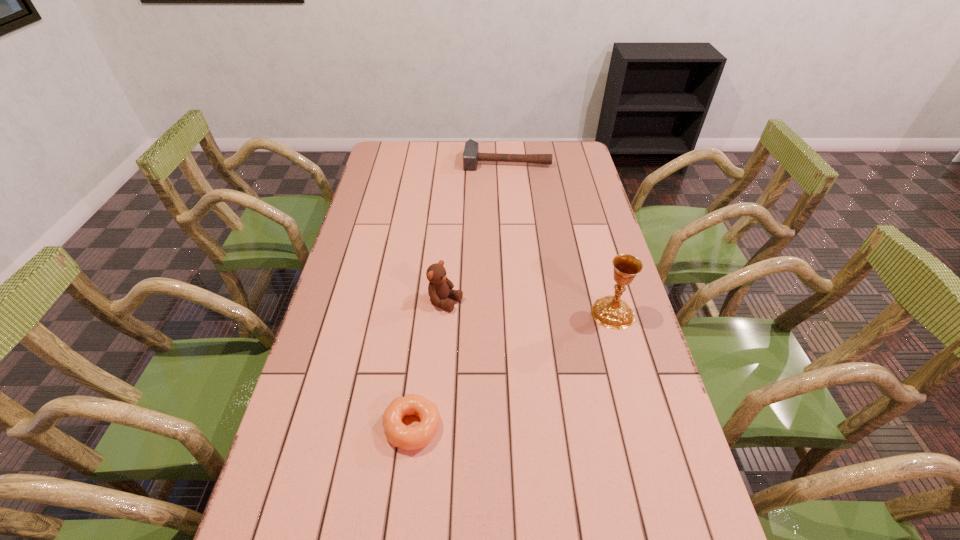
Find the location of a particular element. This screenshot has height=540, width=960. the nearest object is located at coordinates (404, 437).

Where is `the shortest object`? the shortest object is located at coordinates (404, 437).

Where is `chalice`? The width and height of the screenshot is (960, 540). chalice is located at coordinates (611, 312).

Locate an element on the screen. This screenshot has height=540, width=960. the tallest object is located at coordinates (611, 312).

Find the location of a particular element. The height and width of the screenshot is (540, 960). teddy bear is located at coordinates (440, 287).

This screenshot has width=960, height=540. In order to click on hammer in this screenshot , I will do `click(471, 156)`.

Locate an element on the screen. The width and height of the screenshot is (960, 540). free location located on the back of the nearest object is located at coordinates (428, 287).

The image size is (960, 540). What are the coordinates of `vacant space located on the front of the chalice` in the screenshot? It's located at (631, 376).

You are a GUI agent. You are given a task and a screenshot of the screen. Output one action in this format:
    pyautogui.click(x=<x>, y=<y>)
    Task: Click on the vacant region located 0.210m on the face of the third shortest object
    The image size is (960, 540).
    Given the screenshot: What is the action you would take?
    pos(524,337)

The width and height of the screenshot is (960, 540). I want to click on vacant region located on the face of the third shortest object, so click(x=521, y=335).